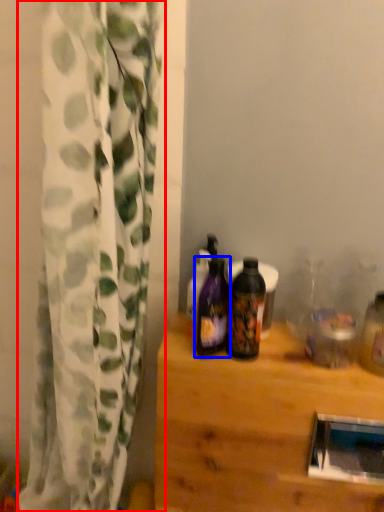
Question: Which object appears farthest to the camera in this image, curtain (highlighted by a red box) or bottle (highlighted by a blue box)?

Choices:
 (A) curtain
 (B) bottle

Answer: (B)